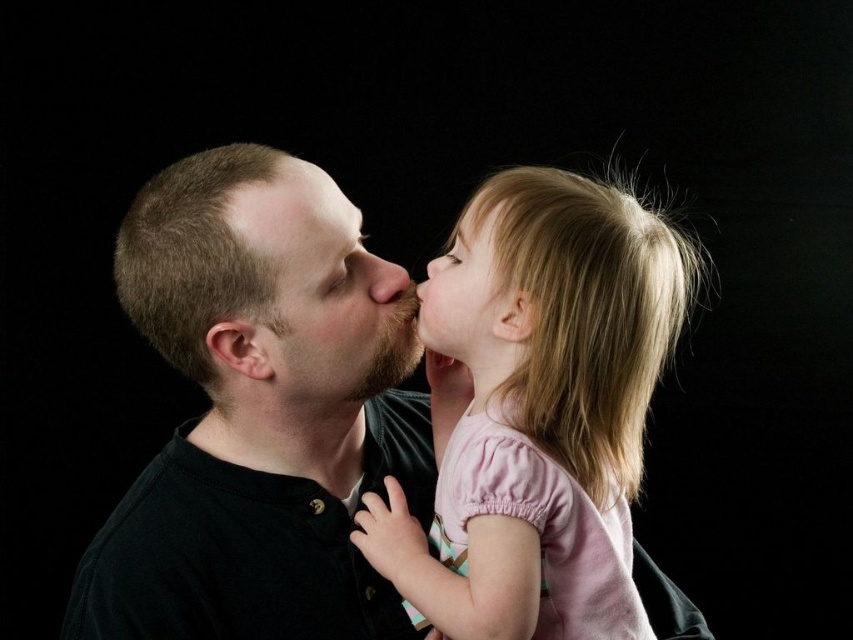
In the scene shown: Does brown matte beard at center appear on the right side of smooth skin at upper center?

Yes, brown matte beard at center is to the right of smooth skin at upper center.

Between brown matte beard at center and smooth skin at upper center, which one appears on the right side from the viewer's perspective?

Positioned to the right is brown matte beard at center.

What do you see at coordinates (328, 292) in the screenshot? I see `brown matte beard at center` at bounding box center [328, 292].

Locate an element on the screen. The image size is (853, 640). brown matte beard at center is located at coordinates (328, 292).

Which is in front, point (645, 228) or point (432, 349)?

Point (645, 228)

Describe the element at coordinates (538, 406) in the screenshot. The width and height of the screenshot is (853, 640). I see `pink fabric at center` at that location.

You are a GUI agent. You are given a task and a screenshot of the screen. Output one action in this format:
    pyautogui.click(x=<x>, y=<y>)
    Task: Click on the pink fabric at center
    This screenshot has width=853, height=640.
    Given the screenshot: What is the action you would take?
    pyautogui.click(x=538, y=406)

Which is more to the left, pink fabric face at center or smooth skin at upper center?

Positioned to the left is smooth skin at upper center.

Is pink fabric face at center smaller than smooth skin at upper center?

No.

Between point (506, 308) and point (289, 202), which one is positioned behind?

The point (289, 202) is behind.

Locate an element on the screen. This screenshot has height=640, width=853. pink fabric face at center is located at coordinates (469, 298).